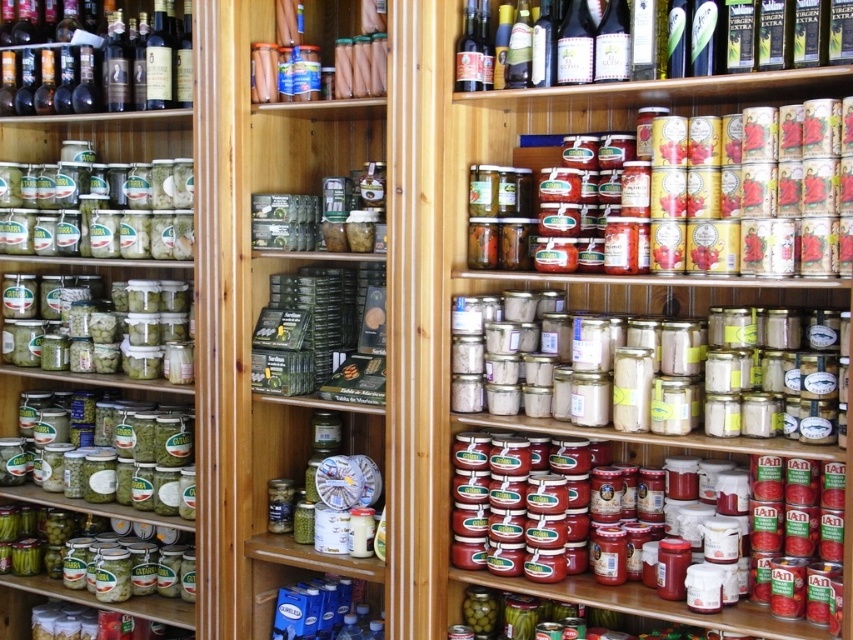
Is shiny dark glass bottles at upper left smaller than green glass bottle at upper center?

No.

Does shiny dark glass bottles at upper left have a lesser width compared to green glass bottle at upper center?

Yes, shiny dark glass bottles at upper left is thinner than green glass bottle at upper center.

Is point (79, 99) positioned before point (614, 84)?

No, it is behind (614, 84).

What are the coordinates of `shiny dark glass bottles at upper left` in the screenshot? It's located at (126, 67).

Does matte glass jars at upper center appear on the right side of green glass bottle at upper center?

No, matte glass jars at upper center is not to the right of green glass bottle at upper center.

Between matte glass jars at upper center and green glass bottle at upper center, which one has less height?

green glass bottle at upper center

Measure the distance between point (624, 118) and camera.

Point (624, 118) is 7.55 feet away from camera.

Where is `matte glass jars at upper center`? The width and height of the screenshot is (853, 640). matte glass jars at upper center is located at coordinates (669, 323).

Does green matte jars at left appear under green glass bottle at upper center?

Correct, green matte jars at left is located below green glass bottle at upper center.

Is point (131, 280) in front of point (567, 93)?

No, it is not.

In order to click on green matte jars at left in this screenshot , I will do `click(105, 358)`.